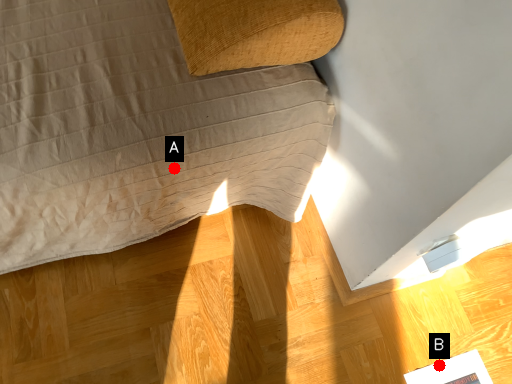
Question: Two points are circled on the image, labeled by A and B beside each circle. Which point is closer to the camera?

Choices:
 (A) A is closer
 (B) B is closer

Answer: (A)